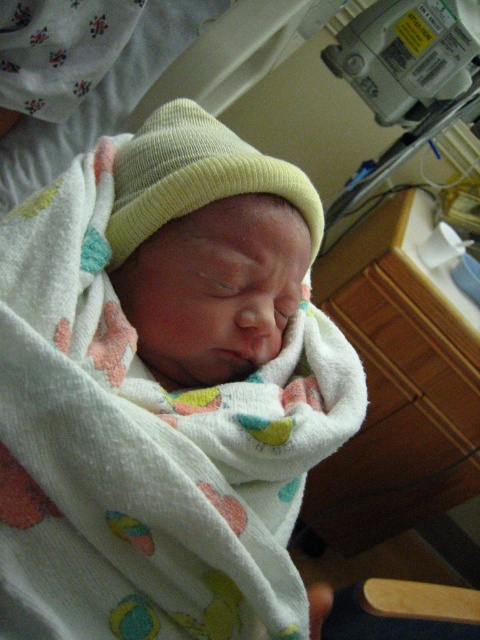
Question: Among these points, which one is farthest from the camera?

Choices:
 (A) (240, 461)
 (B) (156, 129)

Answer: (B)

Question: Is white soft blanket at center above light yellow knit hat at center?

Choices:
 (A) yes
 (B) no

Answer: (B)

Question: Is the position of white soft blanket at center less distant than that of light yellow knit hat at center?

Choices:
 (A) yes
 (B) no

Answer: (A)

Question: Among these objects, which one is nearest to the camera?

Choices:
 (A) white soft blanket at center
 (B) light yellow knit hat at center

Answer: (A)

Question: Does white soft blanket at center appear on the right side of light yellow knit hat at center?

Choices:
 (A) no
 (B) yes

Answer: (B)

Question: Among these points, which one is nearest to the camera?

Choices:
 (A) (220, 323)
 (B) (144, 205)

Answer: (B)